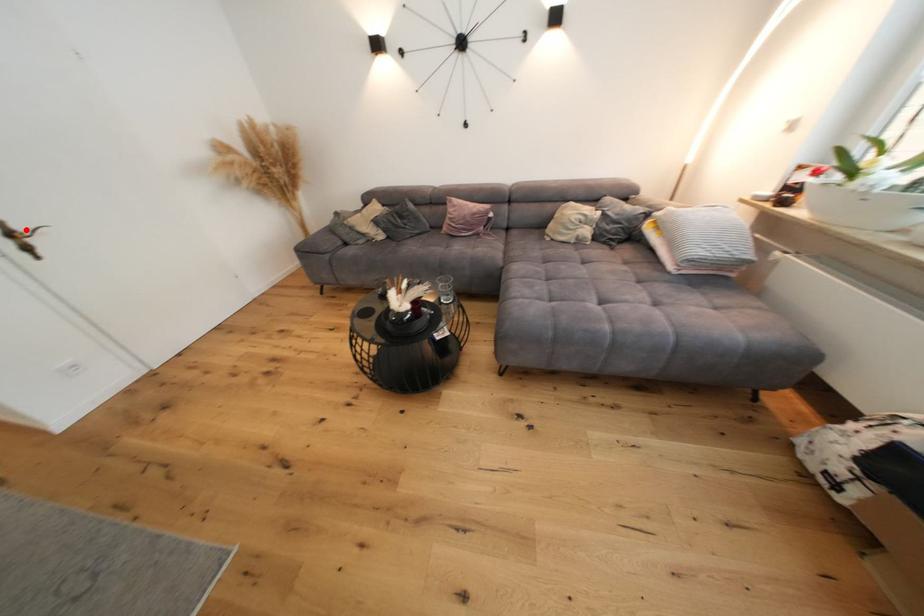
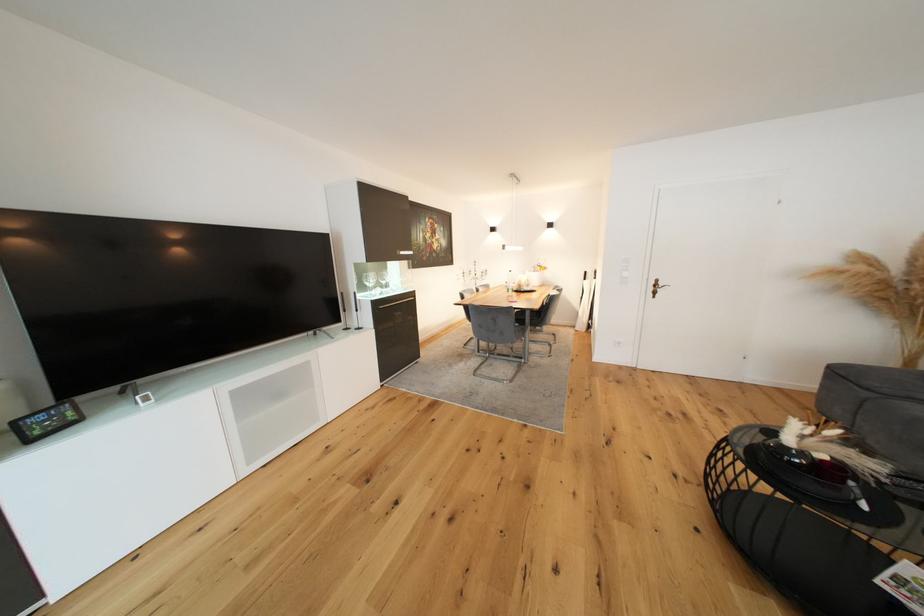
Locate, in the second image, the point that corresponds to the highlighted location in the first image.

(667, 286)